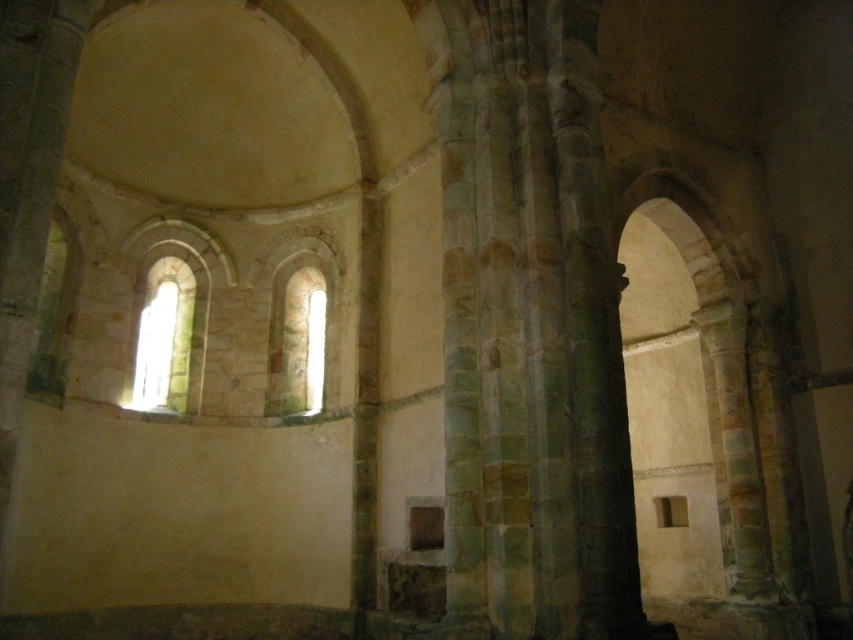
Question: Among these objects, which one is farthest from the camera?

Choices:
 (A) translucent stone window at center
 (B) translucent stone window at left

Answer: (A)

Question: Is translucent stone window at center above translucent glass window at center?

Choices:
 (A) yes
 (B) no

Answer: (A)

Question: Which object appears closest to the camera in this image?

Choices:
 (A) translucent stone window at left
 (B) translucent stone window at center
 (C) translucent glass window at center

Answer: (C)

Question: Does translucent stone window at left appear on the left side of translucent glass window at center?

Choices:
 (A) no
 (B) yes

Answer: (A)

Question: Considering the real-world distances, which object is closest to the translucent stone window at center?

Choices:
 (A) translucent stone window at left
 (B) translucent glass window at center

Answer: (A)

Question: Can you confirm if translucent stone window at left is positioned below translucent stone window at center?

Choices:
 (A) yes
 (B) no

Answer: (B)